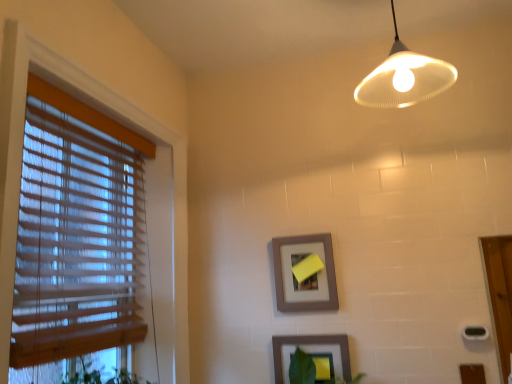
Question: Considering the relative positions of matte gray picture frame at lower center, the 1th picture frame from the bottom, and matte white lampshade at upper center in the image provided, is matte gray picture frame at lower center, the 1th picture frame from the bottom, to the right of matte white lampshade at upper center from the viewer's perspective?

Choices:
 (A) yes
 (B) no

Answer: (B)

Question: Is matte gray picture frame at lower center, the second picture frame from the top, bigger than matte white lampshade at upper center?

Choices:
 (A) no
 (B) yes

Answer: (A)

Question: From the image's perspective, is matte gray picture frame at lower center, the second picture frame from the top, on matte white lampshade at upper center?

Choices:
 (A) no
 (B) yes

Answer: (A)

Question: Does matte gray picture frame at lower center, the second picture frame from the top, lie in front of matte white lampshade at upper center?

Choices:
 (A) yes
 (B) no

Answer: (B)

Question: Is matte gray picture frame at lower center, the second picture frame from the top, thinner than matte white lampshade at upper center?

Choices:
 (A) no
 (B) yes

Answer: (B)

Question: From the image's perspective, is matte gray picture frame at lower center, the 1th picture frame from the bottom, below matte white lampshade at upper center?

Choices:
 (A) no
 (B) yes

Answer: (B)

Question: Considering the relative sizes of matte white lampshade at upper center and wooden blinds at left in the image provided, is matte white lampshade at upper center smaller than wooden blinds at left?

Choices:
 (A) no
 (B) yes

Answer: (B)

Question: From the image's perspective, would you say matte white lampshade at upper center is shown under wooden blinds at left?

Choices:
 (A) yes
 (B) no

Answer: (B)

Question: From a real-world perspective, is matte white lampshade at upper center on top of wooden blinds at left?

Choices:
 (A) yes
 (B) no

Answer: (A)

Question: From the image's perspective, is matte white lampshade at upper center located above wooden blinds at left?

Choices:
 (A) yes
 (B) no

Answer: (A)

Question: Can you confirm if matte white lampshade at upper center is positioned to the left of wooden blinds at left?

Choices:
 (A) yes
 (B) no

Answer: (B)

Question: Is matte white lampshade at upper center not inside wooden blinds at left?

Choices:
 (A) yes
 (B) no

Answer: (A)

Question: Is wooden blinds at left thinner than matte gray picture frame at center, the 1th picture frame from the top?

Choices:
 (A) no
 (B) yes

Answer: (A)